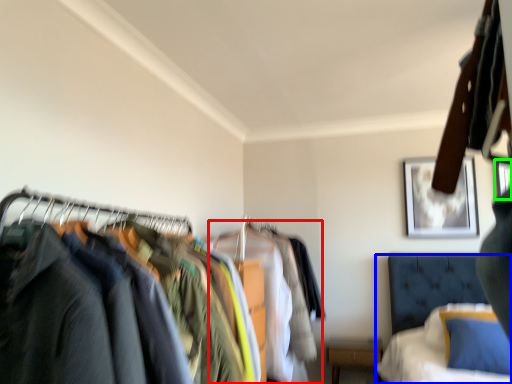
Question: Estimate the real-world distances between objects in this image. Which object is closer to clothing (highlighted by a red box), bed (highlighted by a blue box) or picture frame (highlighted by a green box)?

Choices:
 (A) bed
 (B) picture frame

Answer: (A)